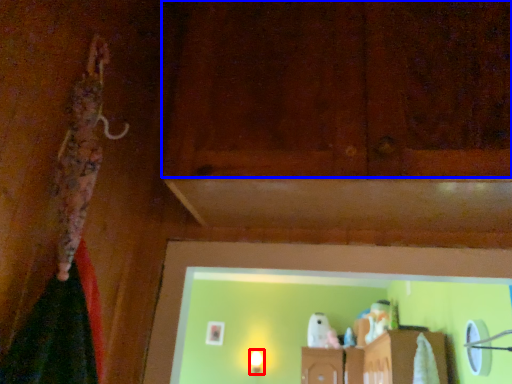
Question: Which object is closer to the camera taking this photo, light fixture (highlighted by a red box) or wood (highlighted by a blue box)?

Choices:
 (A) light fixture
 (B) wood

Answer: (B)